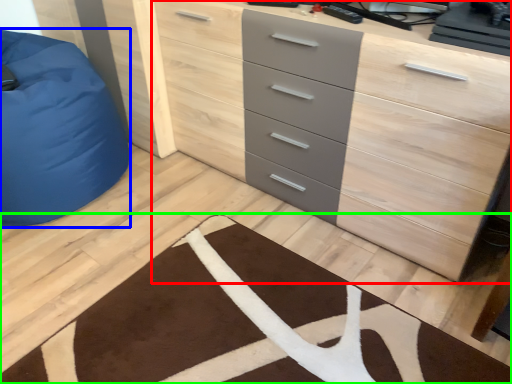
Question: Considering the real-world distances, which object is closest to chest of drawers (highlighted by a red box)? furniture (highlighted by a blue box) or doormat (highlighted by a green box).

Choices:
 (A) furniture
 (B) doormat

Answer: (B)